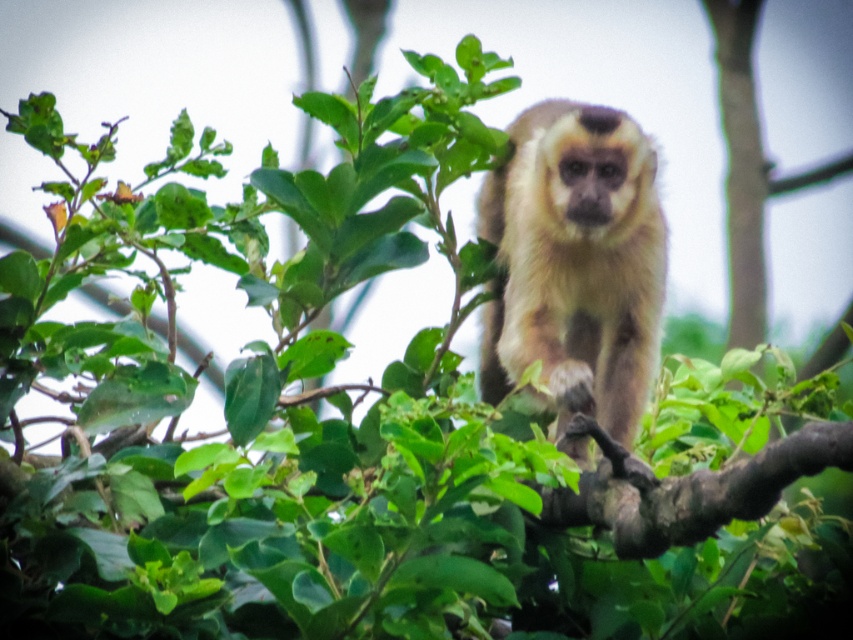
Question: Can you confirm if fuzzy beige monkey at center is positioned to the left of brown rough tree branch at center?

Choices:
 (A) yes
 (B) no

Answer: (A)

Question: Which point is closer to the camera taking this photo?

Choices:
 (A) (671, 518)
 (B) (527, 324)

Answer: (A)

Question: Does fuzzy beige monkey at center have a larger size compared to brown rough tree branch at center?

Choices:
 (A) yes
 (B) no

Answer: (A)

Question: Does fuzzy beige monkey at center appear under brown rough tree branch at center?

Choices:
 (A) yes
 (B) no

Answer: (B)

Question: Which point is closer to the camera taking this photo?

Choices:
 (A) (595, 200)
 (B) (770, 464)

Answer: (B)